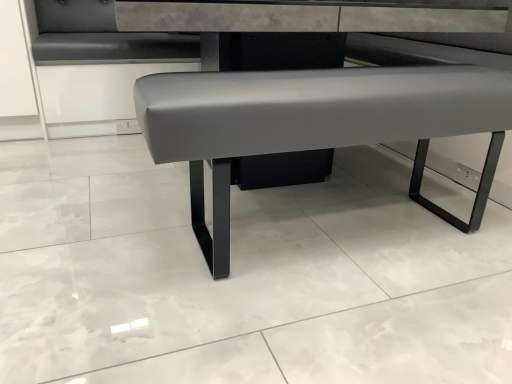
What do you see at coordinates (313, 124) in the screenshot? This screenshot has width=512, height=384. I see `matte gray bench at center` at bounding box center [313, 124].

Identify the location of matte gray bench at center. The height and width of the screenshot is (384, 512). (313, 124).

Locate an element on the screen. This screenshot has height=384, width=512. matte gray bench at center is located at coordinates (313, 124).